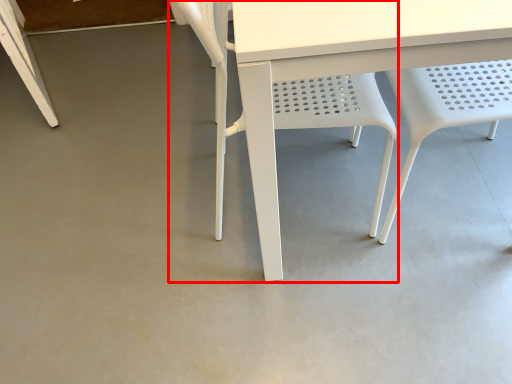
Question: From the image, what is the correct spatial relationship of chair (annotated by the red box) in relation to chair?

Choices:
 (A) right
 (B) left

Answer: (B)